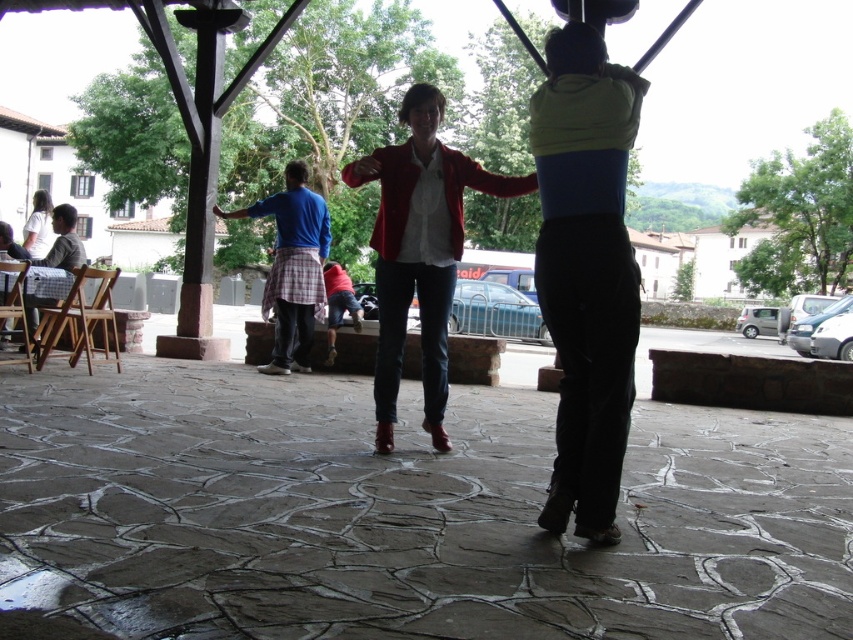
Question: Can you confirm if matte yellow top at center is positioned above checkered fabric shirt at left?

Choices:
 (A) yes
 (B) no

Answer: (B)

Question: Considering the real-world distances, which object is farthest from the white matte shirt at upper left?

Choices:
 (A) matte red blazer at center
 (B) matte yellow top at center

Answer: (A)

Question: Which is nearer to the white matte shirt at upper left?

Choices:
 (A) matte red blazer at center
 (B) checkered fabric shirt at left
 (C) blue cotton shirt at center

Answer: (C)

Question: Where is checkered fabric shirt at left located in relation to white matte shirt at upper left in the image?

Choices:
 (A) right
 (B) left

Answer: (A)

Question: Is matte red blazer at center above checkered fabric shirt at left?

Choices:
 (A) no
 (B) yes

Answer: (B)

Question: Which object is farther from the camera taking this photo?

Choices:
 (A) matte yellow top at center
 (B) matte red blazer at center
 (C) checkered fabric shirt at left
 (D) white matte shirt at upper left

Answer: (D)